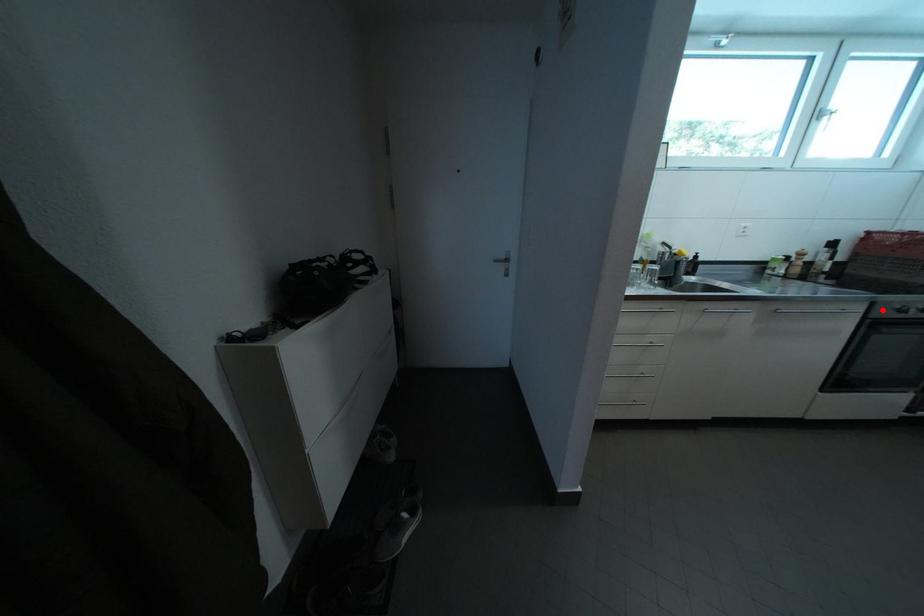
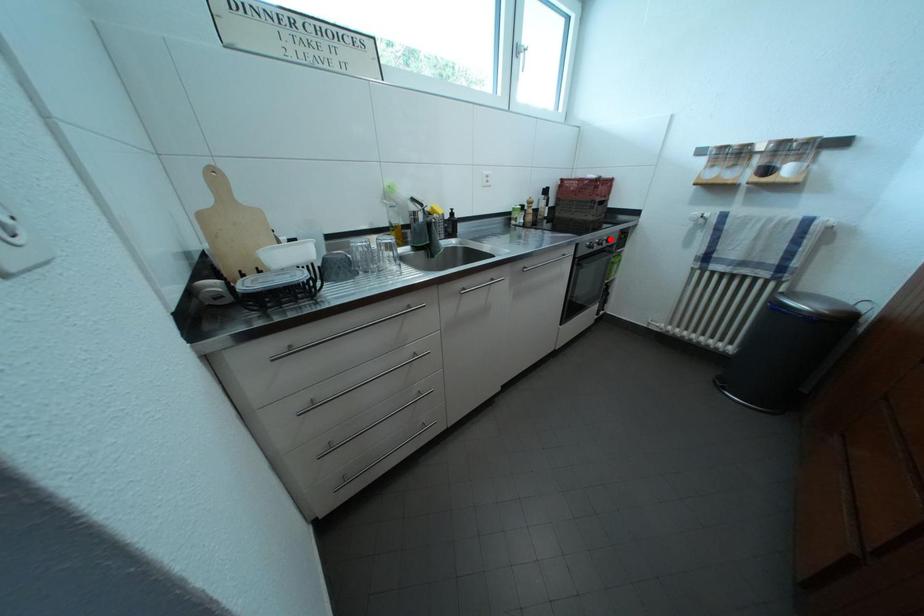
I am providing you with two images of the same scene from different viewpoints. A red point is marked on the first image and another point is marked on the second image. Does the point marked in image1 correspond to the same location as the one in image2?

No